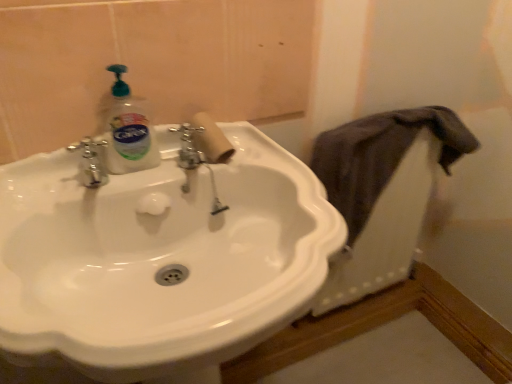
Describe the element at coordinates (381, 156) in the screenshot. The width and height of the screenshot is (512, 384). I see `dark gray fabric at right` at that location.

What is the approximate width of dark gray fabric at right?

It is 5.60 inches.

This screenshot has width=512, height=384. Describe the element at coordinates (129, 130) in the screenshot. I see `clear plastic bottle at upper left` at that location.

You are a GUI agent. You are given a task and a screenshot of the screen. Output one action in this format:
    pyautogui.click(x=<x>, y=<y>)
    Task: Click on the dark gray fabric at right
    
    Given the screenshot: What is the action you would take?
    pyautogui.click(x=381, y=156)

From the image's perspective, is white glossy sink at center located beneath white cardboard toilet paper at center?

Yes.

Does white glossy sink at center contain white cardboard toilet paper at center?

Yes, white cardboard toilet paper at center is inside white glossy sink at center.

From a real-world perspective, is white glossy sink at center physically above white cardboard toilet paper at center?

Incorrect, from a real-world perspective, white glossy sink at center is lower than white cardboard toilet paper at center.

Is white glossy sink at center taller or shorter than clear plastic bottle at upper left?

Considering their sizes, white glossy sink at center has more height than clear plastic bottle at upper left.

From the image's perspective, is white glossy sink at center located above or below clear plastic bottle at upper left?

Clearly, from the image's perspective, white glossy sink at center is below clear plastic bottle at upper left.

Is white glossy sink at center to the right of clear plastic bottle at upper left from the viewer's perspective?

Yes, white glossy sink at center is to the right of clear plastic bottle at upper left.

Locate an element on the screen. sink in front of the clear plastic bottle at upper left is located at coordinates (159, 259).

Between point (153, 146) and point (348, 211), which one is positioned behind?

The point (348, 211) is more distant.

Is clear plastic bottle at upper left positioned before dark gray fabric at right?

Yes, clear plastic bottle at upper left is closer to the viewer.

What's the angular difference between clear plastic bottle at upper left and dark gray fabric at right's facing directions?

There is a 0.00452-degree angle between the facing directions of clear plastic bottle at upper left and dark gray fabric at right.

Locate an element on the screen. The width and height of the screenshot is (512, 384). cleaning product above the dark gray fabric at right (from a real-world perspective) is located at coordinates (129, 130).

Between point (164, 232) and point (356, 233), which one is positioned in front?

The point (164, 232) is closer to the camera.

From the picture: Considering the sizes of white glossy sink at center and dark gray fabric at right in the image, is white glossy sink at center taller or shorter than dark gray fabric at right?

In the image, white glossy sink at center appears to be taller than dark gray fabric at right.

Is white glossy sink at center located outside dark gray fabric at right?

Yes, white glossy sink at center is located beyond the bounds of dark gray fabric at right.

Is white glossy sink at center completely or partially inside dark gray fabric at right?

No.

Does dark gray fabric at right come behind white glossy sink at center?

That is True.

Is point (447, 145) positioned after point (146, 222)?

Yes, point (447, 145) is behind point (146, 222).

Would you say white cardboard toilet paper at center is outside dark gray fabric at right?

Indeed, white cardboard toilet paper at center is completely outside dark gray fabric at right.

Is white cardboard toilet paper at center taller than dark gray fabric at right?

In fact, white cardboard toilet paper at center may be shorter than dark gray fabric at right.

Is white cardboard toilet paper at center looking in the opposite direction of dark gray fabric at right?

No, white cardboard toilet paper at center is not facing the opposite direction of dark gray fabric at right.

Locate an element on the screen. toilet paper lying in front of the dark gray fabric at right is located at coordinates (211, 140).

Which of these two, dark gray fabric at right or white cardboard toilet paper at center, is bigger?

Bigger between the two is dark gray fabric at right.

Locate an element on the screen. Image resolution: width=512 pixels, height=384 pixels. toilet paper above the dark gray fabric at right (from the image's perspective) is located at coordinates (211, 140).

Can you tell me how much dark gray fabric at right and white cardboard toilet paper at center differ in facing direction?

dark gray fabric at right and white cardboard toilet paper at center are facing 0.00921 degrees away from each other.

Based on the photo, which is more to the left, dark gray fabric at right or white cardboard toilet paper at center?

From the viewer's perspective, white cardboard toilet paper at center appears more on the left side.

Identify the location of sink located on the left of white cardboard toilet paper at center. (159, 259).

Locate an element on the screen. cleaning product above the white glossy sink at center (from a real-world perspective) is located at coordinates (129, 130).

Estimate the real-world distances between objects in this image. Which object is further from white glossy sink at center, white cardboard toilet paper at center or dark gray fabric at right?

dark gray fabric at right lies further to white glossy sink at center than the other object.

Based on their spatial positions, is white cardboard toilet paper at center or dark gray fabric at right further from clear plastic bottle at upper left?

→ Based on the image, dark gray fabric at right appears to be further to clear plastic bottle at upper left.

In the scene shown: Which object lies further to the anchor point white cardboard toilet paper at center, clear plastic bottle at upper left or white glossy sink at center?

white glossy sink at center lies further to white cardboard toilet paper at center than the other object.

From the image, which object appears to be nearer to dark gray fabric at right, clear plastic bottle at upper left or white cardboard toilet paper at center?

The object closer to dark gray fabric at right is white cardboard toilet paper at center.

When comparing their distances from white cardboard toilet paper at center, does clear plastic bottle at upper left or dark gray fabric at right seem closer?

clear plastic bottle at upper left lies closer to white cardboard toilet paper at center than the other object.

Estimate the real-world distances between objects in this image. Which object is closer to white glossy sink at center, dark gray fabric at right or white cardboard toilet paper at center?

white cardboard toilet paper at center is positioned closer to the anchor white glossy sink at center.

Estimate the real-world distances between objects in this image. Which object is further from dark gray fabric at right, white glossy sink at center or clear plastic bottle at upper left?

Based on the image, clear plastic bottle at upper left appears to be further to dark gray fabric at right.

Based on their spatial positions, is white cardboard toilet paper at center or clear plastic bottle at upper left further from dark gray fabric at right?

Among the two, clear plastic bottle at upper left is located further to dark gray fabric at right.

Identify the location of toilet paper between white glossy sink at center and dark gray fabric at right from front to back. Image resolution: width=512 pixels, height=384 pixels. (211, 140).

Find the location of a particular element. sink located between clear plastic bottle at upper left and dark gray fabric at right in the left-right direction is located at coordinates (159, 259).

The width and height of the screenshot is (512, 384). Identify the location of toilet paper between clear plastic bottle at upper left and white glossy sink at center vertically. (211, 140).

In order to click on toilet paper situated between clear plastic bottle at upper left and dark gray fabric at right from left to right in this screenshot , I will do `click(211, 140)`.